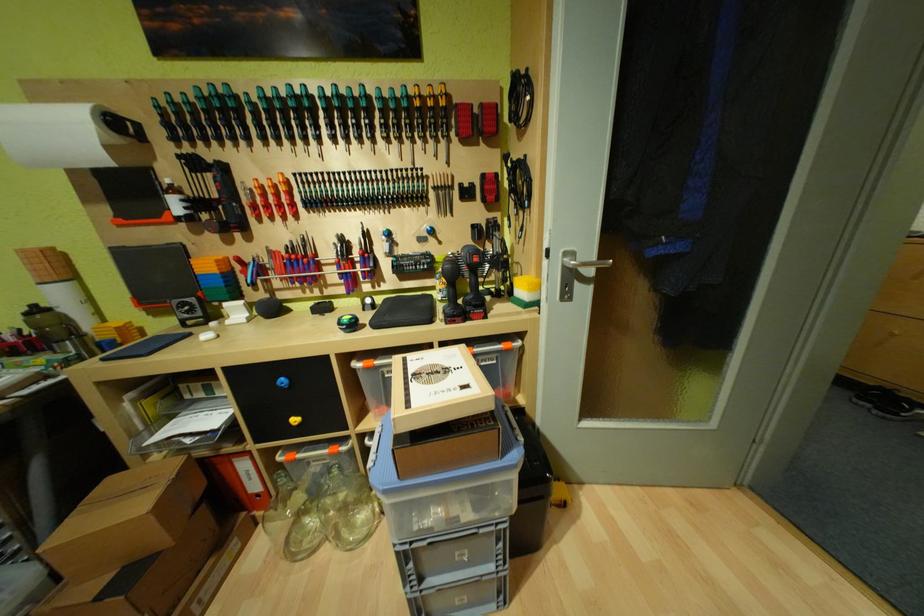
Locate an element on the screen. The image size is (924, 616). yellow drawer knob is located at coordinates pos(295,419).